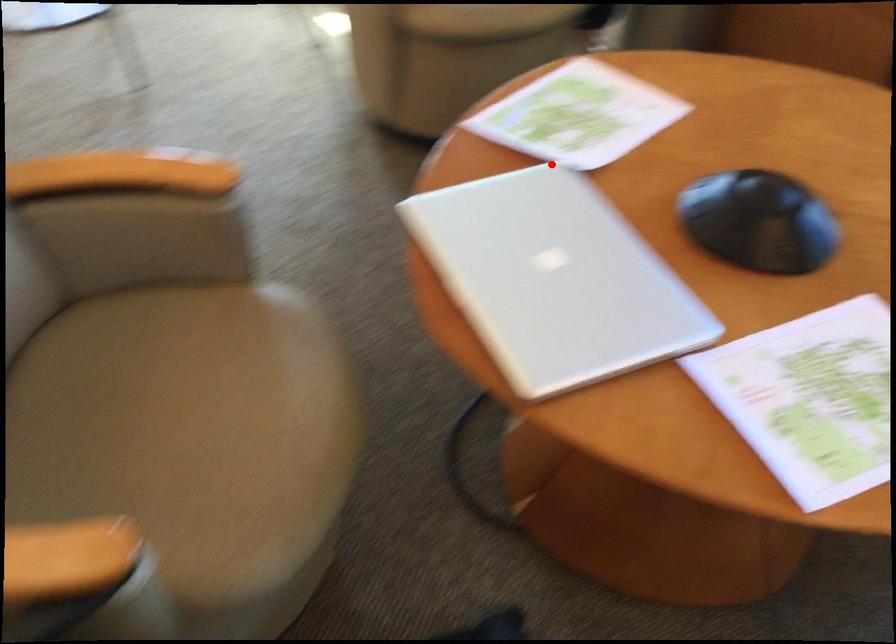
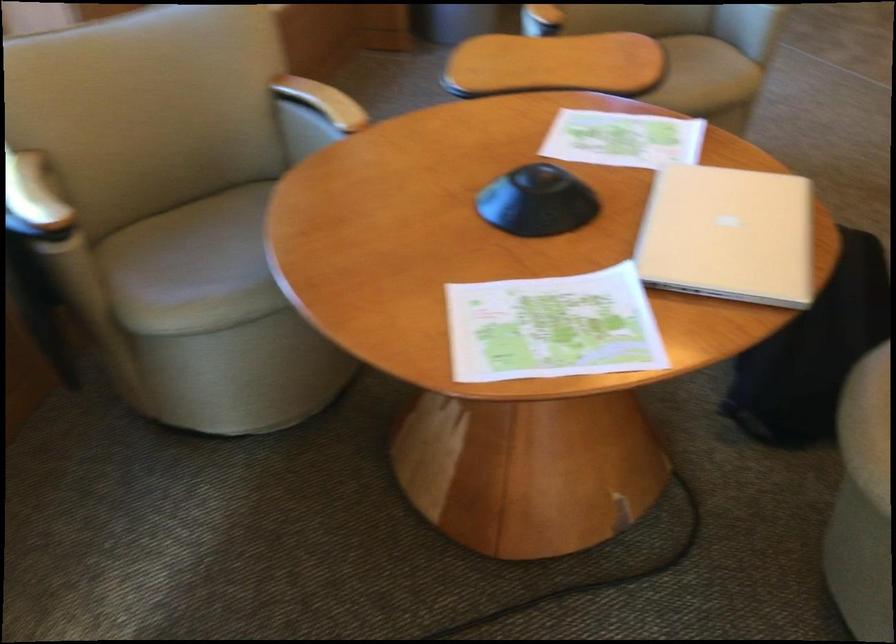
In the second image, find the point that corresponds to the highlighted location in the first image.

(552, 327)